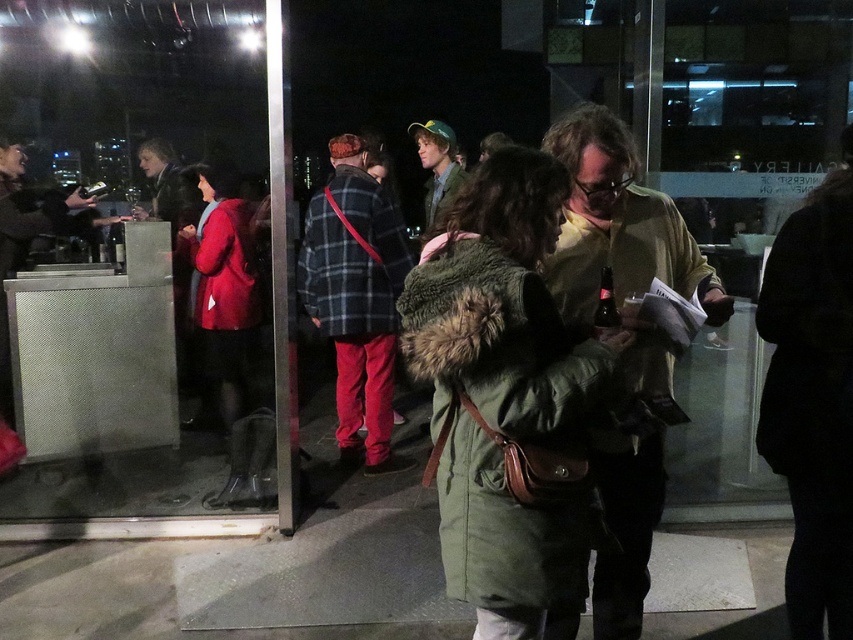
Question: Can you confirm if plaid wool jacket at center is smaller than matte red coat at center?

Choices:
 (A) yes
 (B) no

Answer: (A)

Question: Can you confirm if green fuzzy coat at center is smaller than matte yellow shirt at center?

Choices:
 (A) no
 (B) yes

Answer: (B)

Question: Does matte yellow shirt at center have a greater width compared to plaid wool jacket at center?

Choices:
 (A) yes
 (B) no

Answer: (B)

Question: Which point is closer to the camera taking this photo?

Choices:
 (A) (650, 236)
 (B) (347, 326)
 (C) (218, 364)
 (D) (491, 632)

Answer: (D)

Question: Which object appears closest to the camera in this image?

Choices:
 (A) green fuzzy coat at center
 (B) green woolen hat at center
 (C) matte red coat at center
 (D) matte yellow shirt at center

Answer: (A)

Question: Which object is positioned farthest from the matte red coat at center?

Choices:
 (A) green fuzzy coat at center
 (B) plaid wool jacket at center

Answer: (A)